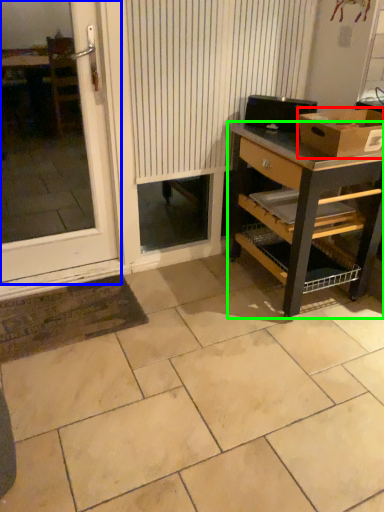
Question: Which object is positioned closest to box (highlighted by a red box)? Select from window (highlighted by a blue box) and desk (highlighted by a green box).

Choices:
 (A) window
 (B) desk

Answer: (B)